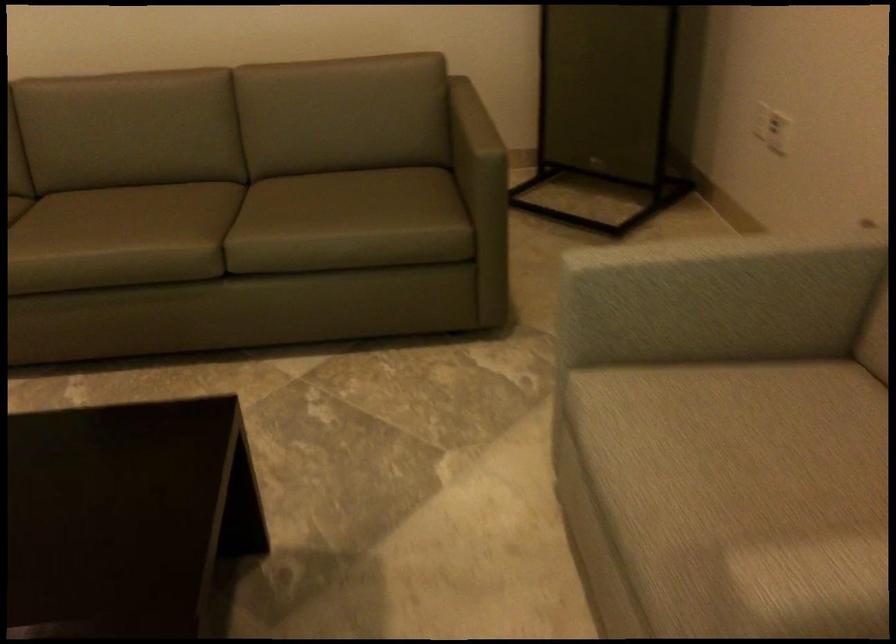
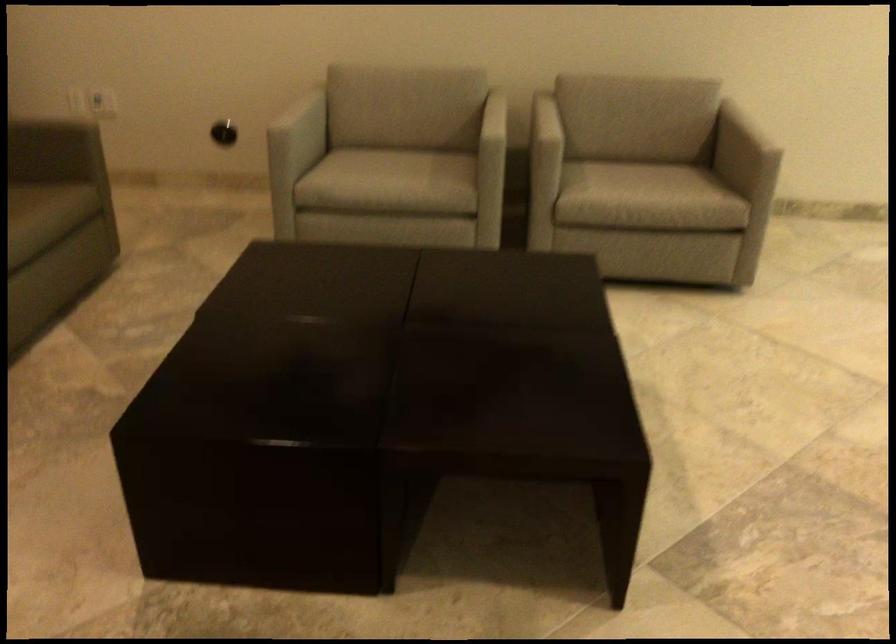
Where in the second image is the point corresponding to point (811, 308) from the first image?

(304, 124)